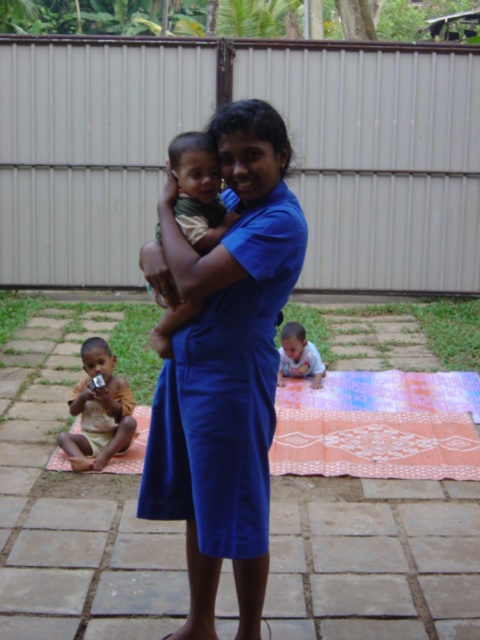
Does matte green shirt at center appear on the right side of soft beige skin at center?

In fact, matte green shirt at center is to the left of soft beige skin at center.

I want to click on matte green shirt at center, so click(x=197, y=189).

Looking at this image, can you confirm if blue fabric dress at center is positioned to the right of matte green shirt at center?

Yes, blue fabric dress at center is to the right of matte green shirt at center.

How far apart are blue fabric dress at center and matte green shirt at center?

blue fabric dress at center and matte green shirt at center are 63.95 centimeters apart.

Does point (169, 499) come in front of point (202, 248)?

No, it is not.

You are a GUI agent. You are given a task and a screenshot of the screen. Output one action in this format:
    pyautogui.click(x=<x>, y=<y>)
    Task: Click on the blue fabric dress at center
    This screenshot has width=480, height=640.
    Given the screenshot: What is the action you would take?
    pyautogui.click(x=226, y=392)

Is point (74, 396) positioned after point (300, 332)?

No, (74, 396) is in front of (300, 332).

Is brown cotton cloth at lower left positioned at the back of soft beige skin at center?

No, it is not.

Where is `brown cotton cloth at lower left`? brown cotton cloth at lower left is located at coordinates (98, 410).